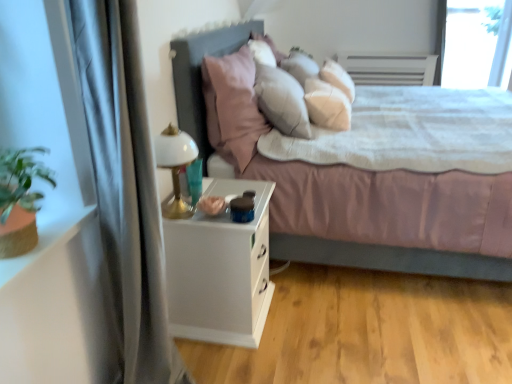
Question: Is transparent glass window screen at upper right behind silky gray curtain at left?

Choices:
 (A) no
 (B) yes

Answer: (B)

Question: From a real-world perspective, is transparent glass window screen at upper right positioned over silky gray curtain at left based on gravity?

Choices:
 (A) yes
 (B) no

Answer: (A)

Question: Is silky gray curtain at left completely or partially inside transparent glass window screen at upper right?

Choices:
 (A) no
 (B) yes

Answer: (A)

Question: Are transparent glass window screen at upper right and silky gray curtain at left making contact?

Choices:
 (A) yes
 (B) no

Answer: (B)

Question: Considering the relative sizes of transparent glass window screen at upper right and silky gray curtain at left in the image provided, is transparent glass window screen at upper right smaller than silky gray curtain at left?

Choices:
 (A) yes
 (B) no

Answer: (A)

Question: Considering the positions of matte gray bed at center and silky gray curtain at left in the image, is matte gray bed at center wider or thinner than silky gray curtain at left?

Choices:
 (A) wide
 (B) thin

Answer: (A)

Question: In the image, is matte gray bed at center on the left side or the right side of silky gray curtain at left?

Choices:
 (A) right
 (B) left

Answer: (A)

Question: Is matte gray bed at center situated inside silky gray curtain at left or outside?

Choices:
 (A) inside
 (B) outside

Answer: (B)

Question: Is matte gray bed at center taller or shorter than silky gray curtain at left?

Choices:
 (A) tall
 (B) short

Answer: (B)

Question: In terms of height, does white glossy table lamp at left look taller or shorter compared to silky gray curtain at left?

Choices:
 (A) tall
 (B) short

Answer: (B)

Question: From a real-world perspective, is white glossy table lamp at left positioned above or below silky gray curtain at left?

Choices:
 (A) above
 (B) below

Answer: (A)

Question: From the image's perspective, is white glossy table lamp at left located above or below silky gray curtain at left?

Choices:
 (A) above
 (B) below

Answer: (A)

Question: In terms of width, does white glossy table lamp at left look wider or thinner when compared to silky gray curtain at left?

Choices:
 (A) wide
 (B) thin

Answer: (B)

Question: From a real-world perspective, is white glossy table lamp at left positioned above or below matte gray bed at center?

Choices:
 (A) above
 (B) below

Answer: (A)

Question: From the image's perspective, is white glossy table lamp at left positioned above or below matte gray bed at center?

Choices:
 (A) below
 (B) above

Answer: (A)